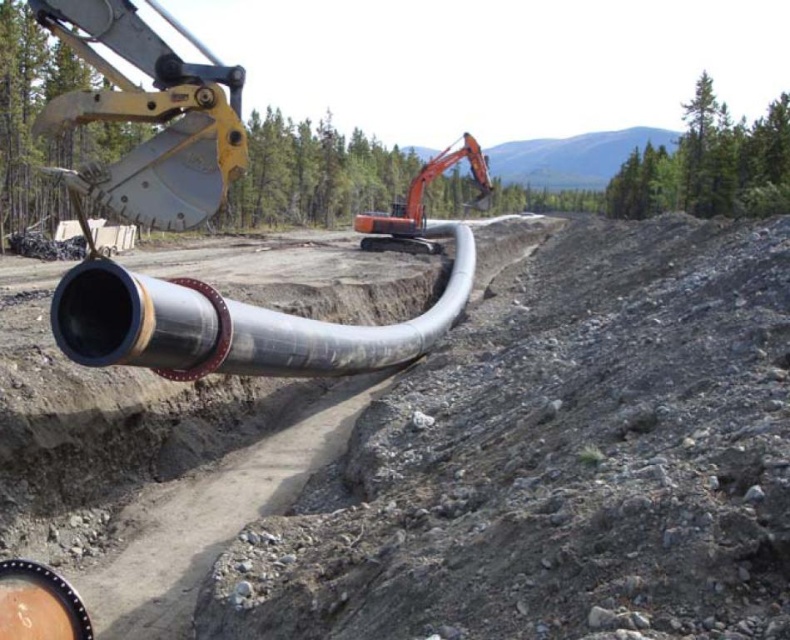
The width and height of the screenshot is (790, 640). Describe the element at coordinates (234, 324) in the screenshot. I see `smooth metallic pipe at center` at that location.

Which of these two, smooth metallic pipe at center or orange metallic excavator at center, stands taller?

With more height is orange metallic excavator at center.

The width and height of the screenshot is (790, 640). Identify the location of smooth metallic pipe at center. (234, 324).

Image resolution: width=790 pixels, height=640 pixels. In order to click on smooth metallic pipe at center in this screenshot , I will do `click(234, 324)`.

Who is taller, silver metallic pipe at center or orange metallic excavator at center?

orange metallic excavator at center

In the scene shown: How far apart are silver metallic pipe at center and orange metallic excavator at center?

They are 99.87 feet apart.

I want to click on silver metallic pipe at center, so click(x=557, y=461).

Is smooth metallic pipe at center further to camera compared to yellow metallic excavator bucket at upper left?

Yes, smooth metallic pipe at center is behind yellow metallic excavator bucket at upper left.

Looking at this image, is smooth metallic pipe at center bigger than yellow metallic excavator bucket at upper left?

No, smooth metallic pipe at center is not bigger than yellow metallic excavator bucket at upper left.

The width and height of the screenshot is (790, 640). I want to click on smooth metallic pipe at center, so click(234, 324).

Where is `smooth metallic pipe at center`? This screenshot has height=640, width=790. smooth metallic pipe at center is located at coordinates (234, 324).